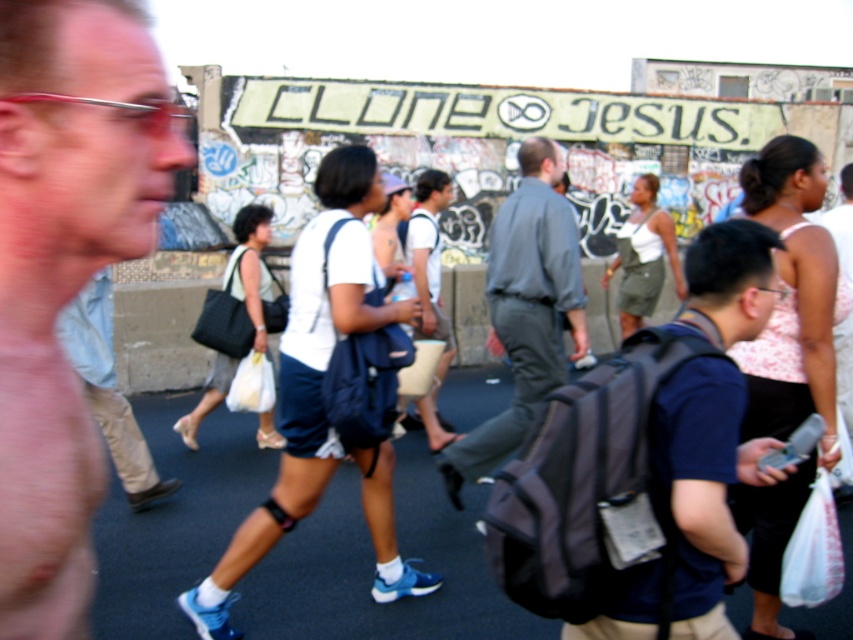
Question: Which object appears closest to the camera in this image?

Choices:
 (A) matte blue shorts at center
 (B) black asphalt at center

Answer: (A)

Question: Which point is farther from the camera taking this photo?

Choices:
 (A) (74, 304)
 (B) (97, 170)

Answer: (A)

Question: Can you confirm if black asphalt at center is positioned to the left of gray cotton shirt at center?

Choices:
 (A) no
 (B) yes

Answer: (B)

Question: Which is farther from the light blue denim jeans at center?

Choices:
 (A) gray cotton shirt at center
 (B) matte blue shorts at center

Answer: (B)

Question: Can you confirm if gray cotton shirt at center is bigger than light blue denim jeans at center?

Choices:
 (A) yes
 (B) no

Answer: (A)

Question: Is the position of black asphalt at center less distant than that of gray cotton shirt at center?

Choices:
 (A) yes
 (B) no

Answer: (A)